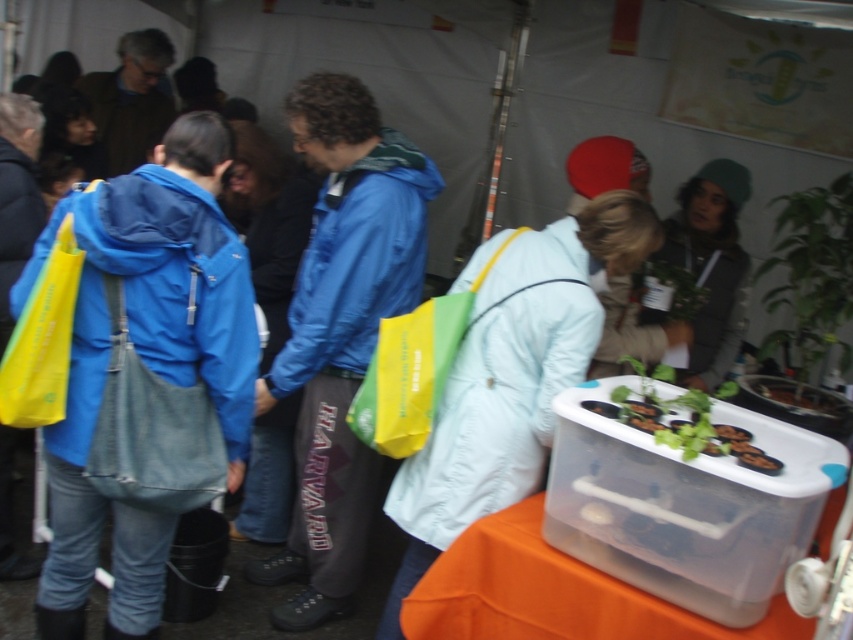
Which is more to the right, blue fabric jacket at upper left or black matte eggplant at lower right?

Positioned to the right is black matte eggplant at lower right.

Who is taller, blue fabric jacket at upper left or black matte eggplant at lower right?

blue fabric jacket at upper left

Which is behind, point (165, 97) or point (776, 460)?

Point (165, 97)

Where is `blue fabric jacket at upper left`? Image resolution: width=853 pixels, height=640 pixels. blue fabric jacket at upper left is located at coordinates (125, 118).

Looking at this image, is blue fabric jacket at center to the left of black matte food at lower right from the viewer's perspective?

Indeed, blue fabric jacket at center is positioned on the left side of black matte food at lower right.

From the picture: Is blue fabric jacket at center positioned in front of black matte food at lower right?

No, blue fabric jacket at center is further to the viewer.

Does point (381, 204) come closer to viewer compared to point (717, 422)?

No, it is behind (717, 422).

The image size is (853, 640). What are the coordinates of `blue fabric jacket at center` in the screenshot? It's located at (340, 332).

Where is `green knit hat at upper center`? green knit hat at upper center is located at coordinates (711, 266).

Is green knit hat at upper center to the left of black matte food at lower right from the viewer's perspective?

No, green knit hat at upper center is not to the left of black matte food at lower right.

Does point (727, 228) come in front of point (715, 428)?

No, (727, 228) is behind (715, 428).

Locate an element on the screen. green knit hat at upper center is located at coordinates (711, 266).